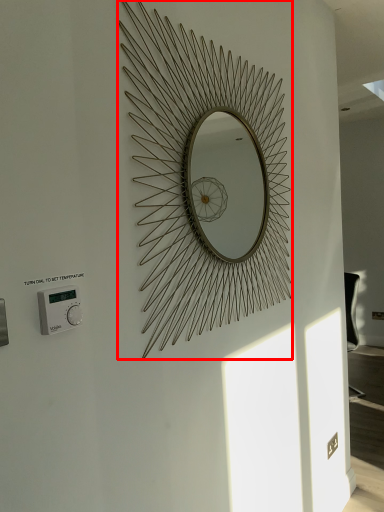
Question: In this image, where is oval (annotated by the red box) located relative to thermostat?

Choices:
 (A) left
 (B) right

Answer: (B)